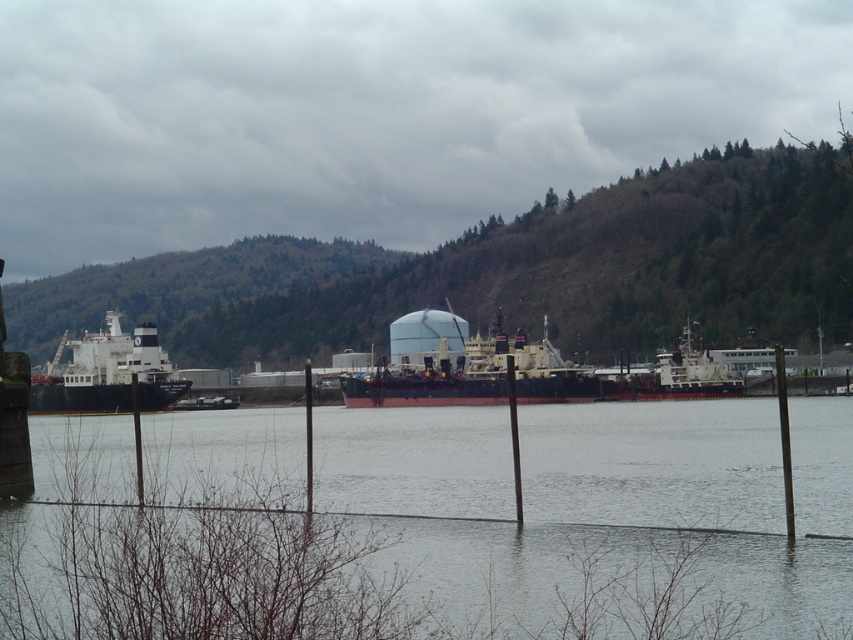
Question: Based on their relative distances, which object is nearer to the white matte ship at left?

Choices:
 (A) reddish-brown metallic ship at center
 (B) clear water at center

Answer: (B)

Question: Considering the real-world distances, which object is closest to the white matte ship at left?

Choices:
 (A) reddish-brown metallic ship at center
 (B) clear water at center

Answer: (B)

Question: Is clear water at center closer to the viewer compared to reddish-brown metallic ship at center?

Choices:
 (A) no
 (B) yes

Answer: (B)

Question: Which object is positioned farthest from the clear water at center?

Choices:
 (A) reddish-brown metallic ship at center
 (B) white matte ship at left

Answer: (A)

Question: Is clear water at center smaller than reddish-brown metallic ship at center?

Choices:
 (A) no
 (B) yes

Answer: (A)

Question: Where is reddish-brown metallic ship at center located in relation to white matte ship at left in the image?

Choices:
 (A) above
 (B) below

Answer: (A)